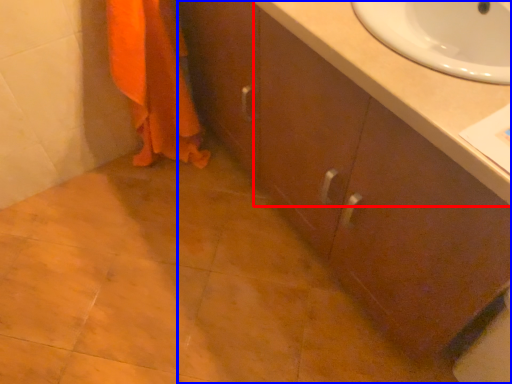
Question: Which of the following is the farthest to the observer, counter top (highlighted by a red box) or bathroom cabinet (highlighted by a blue box)?

Choices:
 (A) counter top
 (B) bathroom cabinet

Answer: (A)